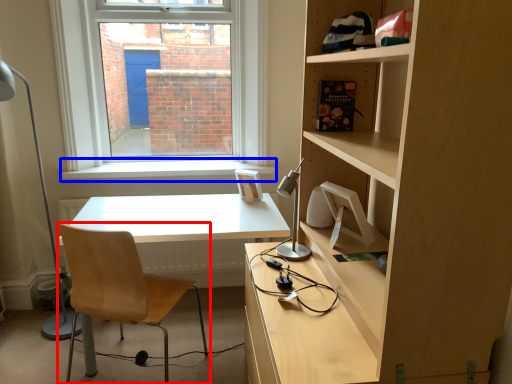
Question: Which point is closer to the camera, chair (highlighted by a red box) or window sill (highlighted by a blue box)?

Choices:
 (A) chair
 (B) window sill

Answer: (A)